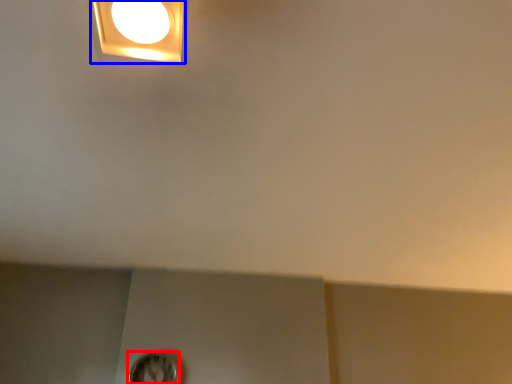
Question: Which object appears farthest to the camera in this image, clock (highlighted by a red box) or lamp (highlighted by a blue box)?

Choices:
 (A) clock
 (B) lamp

Answer: (A)